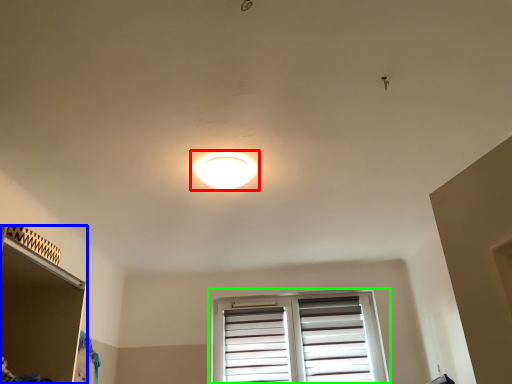
Question: Estimate the real-world distances between objects in this image. Which object is closer to lamp (highlighted by a red box), shelf (highlighted by a blue box) or window (highlighted by a green box)?

Choices:
 (A) shelf
 (B) window

Answer: (A)